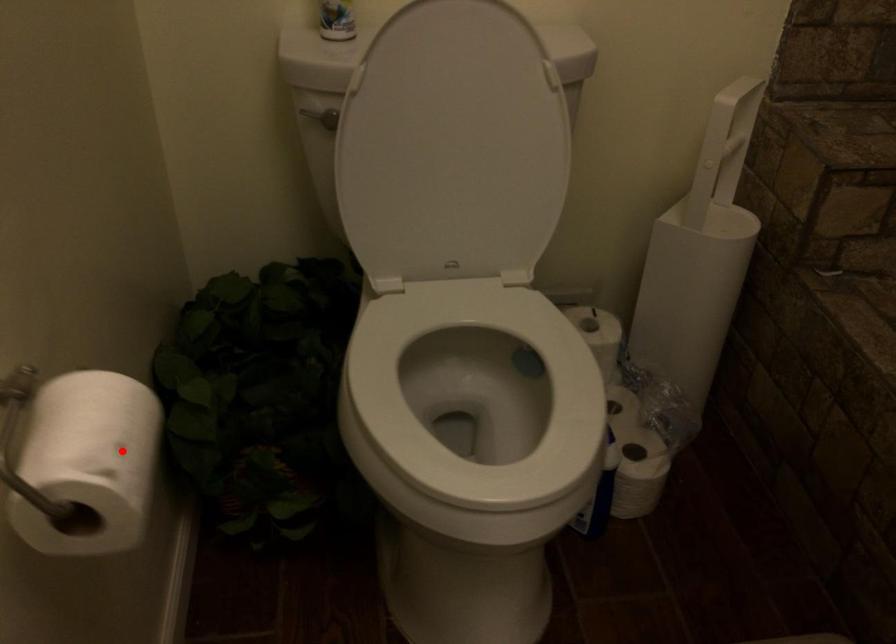
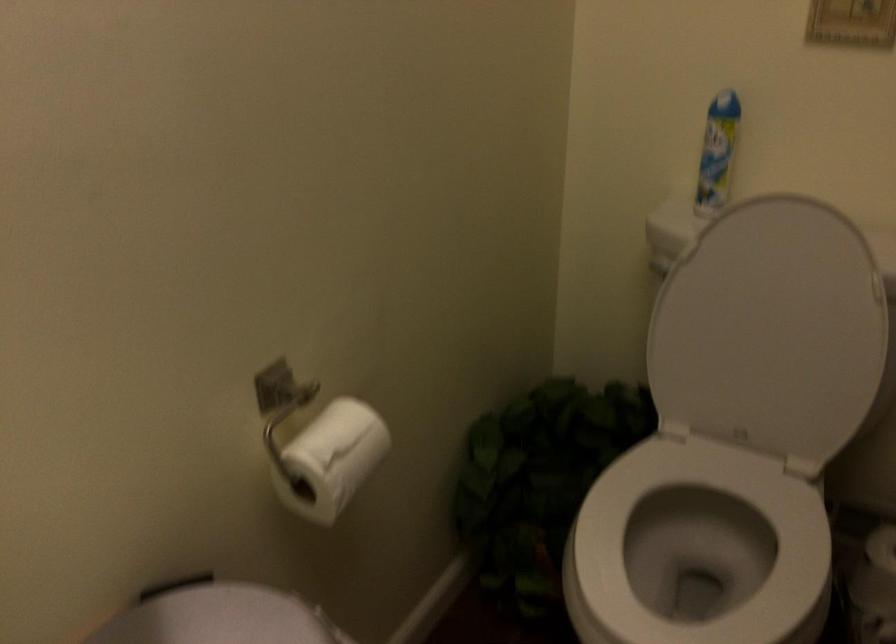
Question: I am providing you with two images of the same scene from different viewpoints. In image1, a red point is highlighted. Considering the same 3D point in image2, which of the following is correct?

Choices:
 (A) It is closer
 (B) It is farther

Answer: (B)